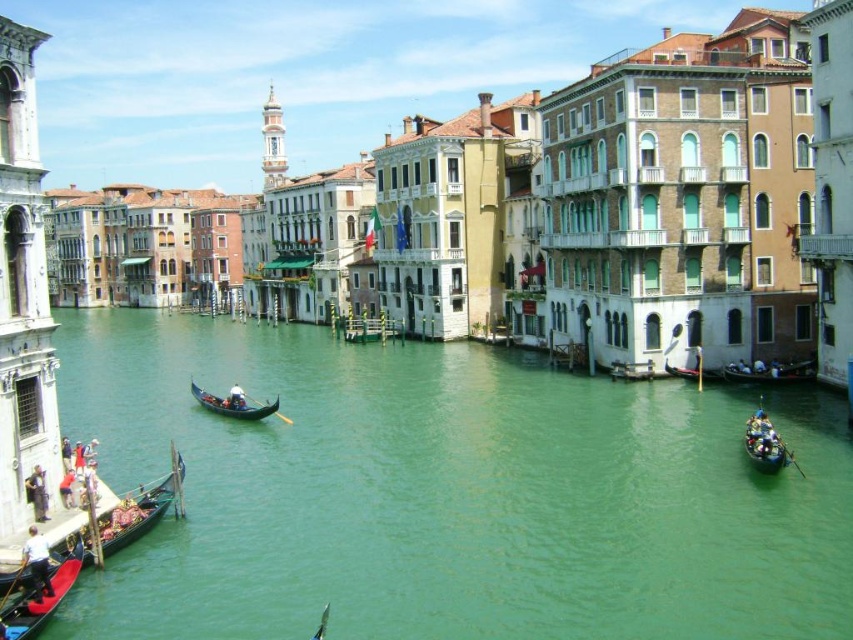
You are standing on the bridge overlooking the dark wood gondola at right. You want to take a photo of it but your camera can only focus on objects within 50 meters. Will the gondola be in focus?

The dark wood gondola at right is 75.09 meters away from the camera, which is beyond the 50 meters focus range. Therefore, the gondola will not be in focus.

From the picture: You are standing on a bridge overlooking the canal. You see the green water at center and the dark wood gondola at right. Which object is nearer to you?

The green water at center is closer to the viewer than the dark wood gondola at right.

You are a tourist standing on the bridge overlooking the green water at center and the dark wood gondola at right. Which object is located directly above the other?

The dark wood gondola at right is positioned above the green water at center.